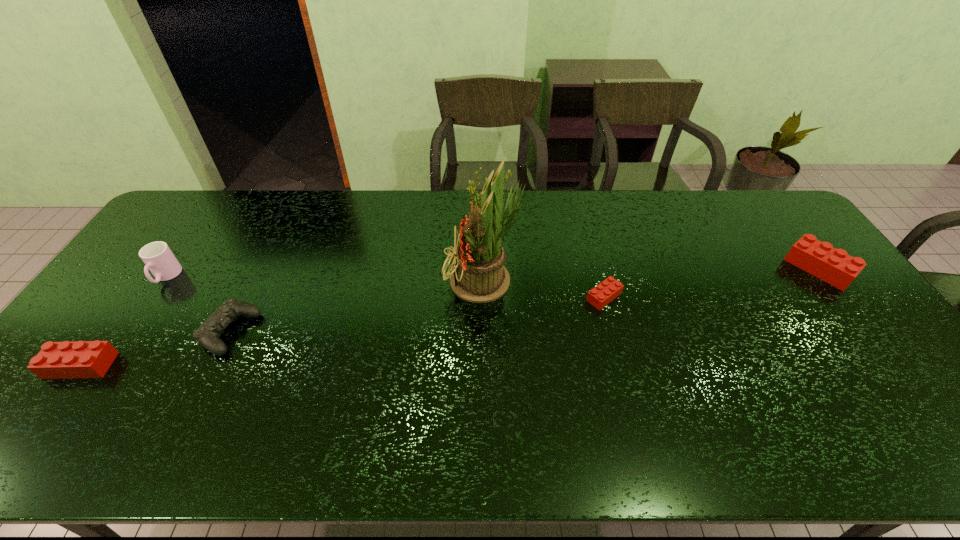
Please mark a free spot for a new Lego to balance the arrangement. Please provide its 2D coordinates. Your answer should be formatted as a tuple, i.e. [(x, y)], where the tuple contains the x and y coordinates of a point satisfying the conditions above.

[(360, 329)]